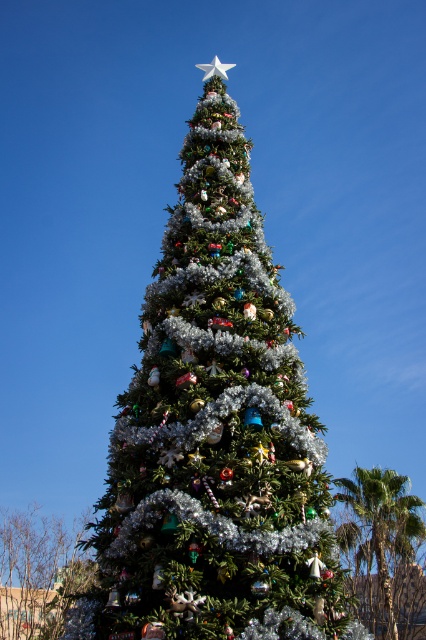
Question: Is green shiny christmas tree at lower left positioned in front of green leafy palm at lower right?

Choices:
 (A) yes
 (B) no

Answer: (B)

Question: Can you confirm if green shiny christmas tree at lower left is thinner than green leafy palm at lower right?

Choices:
 (A) yes
 (B) no

Answer: (B)

Question: Can you confirm if green leafy palm at lower right is thinner than white metallic star at top?

Choices:
 (A) yes
 (B) no

Answer: (B)

Question: Which point is farther to the camera?

Choices:
 (A) green textured christmas tree at center
 (B) white metallic star at top
 (C) green leafy palm at lower right
 (D) green shiny christmas tree at lower left

Answer: (D)

Question: Which of the following is the closest to the observer?

Choices:
 (A) green shiny christmas tree at lower left
 (B) green leafy palm at lower right
 (C) green textured christmas tree at center
 (D) white metallic star at top

Answer: (C)

Question: Which of the following is the farthest from the observer?

Choices:
 (A) (46, 604)
 (B) (288, 490)
 (C) (210, 70)

Answer: (A)